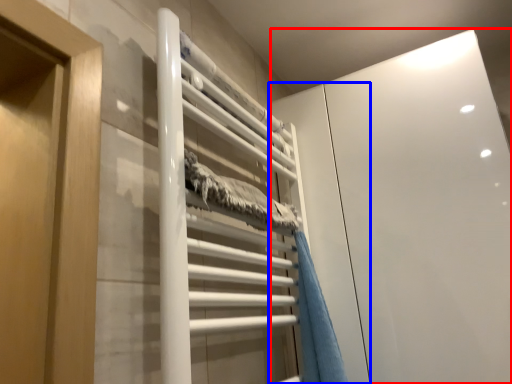
Question: Among these objects, which one is nearest to the camera, glass door (highlighted by a red box) or screen door (highlighted by a blue box)?

Choices:
 (A) glass door
 (B) screen door

Answer: (B)